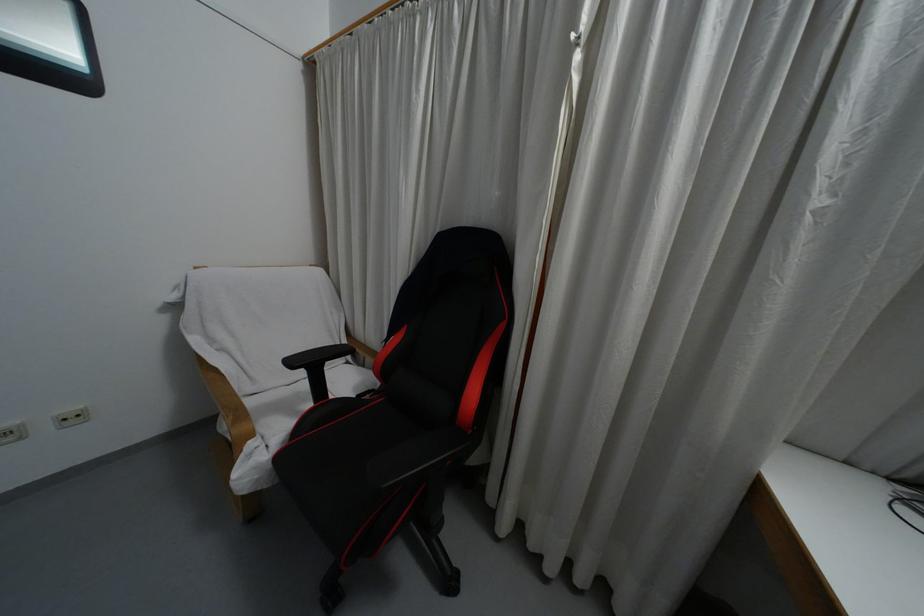
You are a GUI agent. You are given a task and a screenshot of the screen. Output one action in this format:
    pyautogui.click(x=<x>, y=<y>)
    Task: Click on the wooden chair armrest
    The width and height of the screenshot is (924, 616).
    Given the screenshot: What is the action you would take?
    pyautogui.click(x=227, y=406)